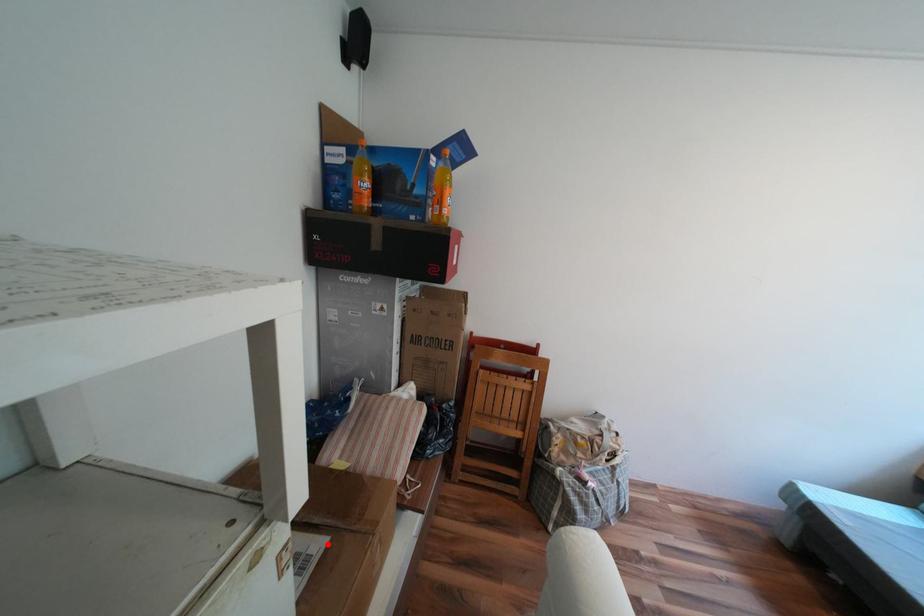
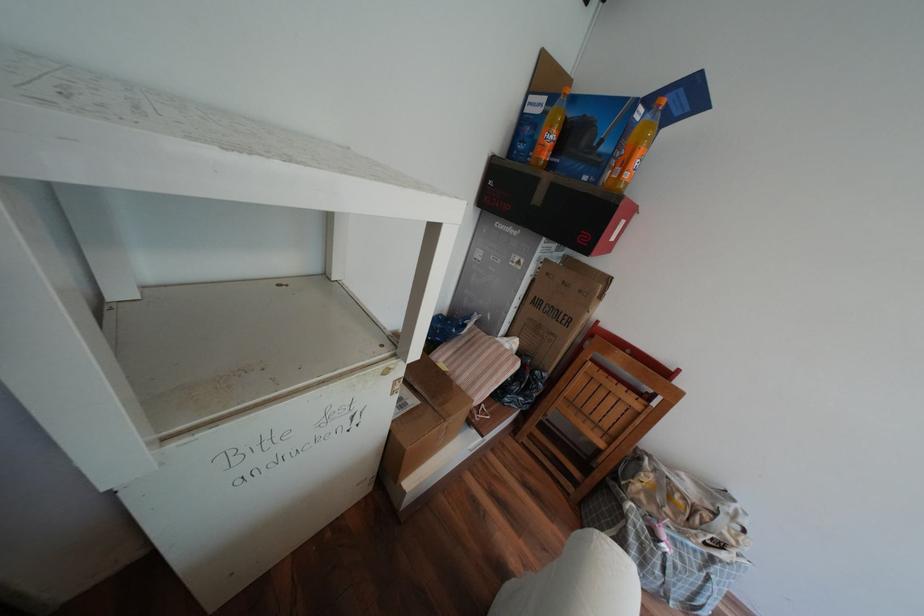
Question: I am providing you with two images of the same scene from different viewpoints. A red point is shown in image1. For the corresponding object point in image2, is it positioned nearer or farther from the camera?

Choices:
 (A) Nearer
 (B) Farther

Answer: (B)